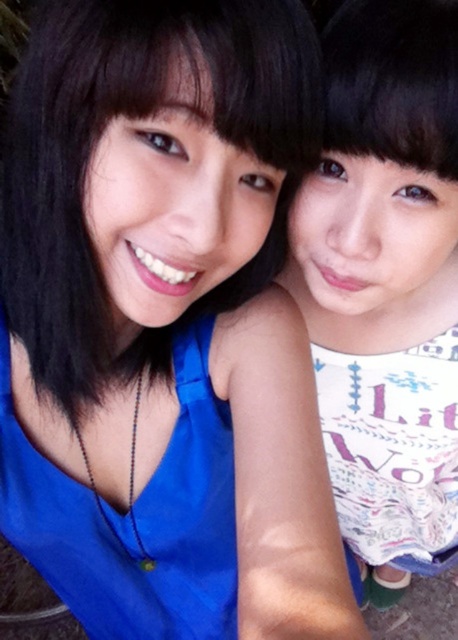
Question: Does white printed dress at center appear on the right side of matte blue dress at center?

Choices:
 (A) no
 (B) yes

Answer: (B)

Question: Which point appears farthest from the camera in this image?

Choices:
 (A) (358, 36)
 (B) (200, 616)

Answer: (B)

Question: Is white printed dress at center bigger than matte blue dress at center?

Choices:
 (A) yes
 (B) no

Answer: (A)

Question: Does white printed dress at center appear on the left side of matte blue dress at center?

Choices:
 (A) yes
 (B) no

Answer: (B)

Question: Which point is farther to the camera?

Choices:
 (A) matte blue dress at center
 (B) white printed dress at center

Answer: (A)